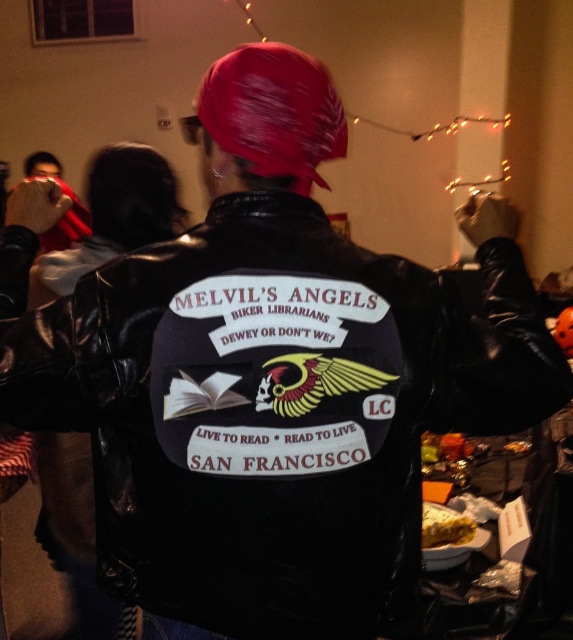
Can you confirm if black leather jacket at center is positioned below yellow crumbly cake at lower right?

Incorrect, black leather jacket at center is not positioned below yellow crumbly cake at lower right.

Is point (99, 552) in front of point (435, 516)?

Yes, point (99, 552) is in front of point (435, 516).

You are a GUI agent. You are given a task and a screenshot of the screen. Output one action in this format:
    pyautogui.click(x=<x>, y=<y>)
    Task: Click on the black leather jacket at center
    This screenshot has height=640, width=573.
    Given the screenshot: What is the action you would take?
    pyautogui.click(x=272, y=404)